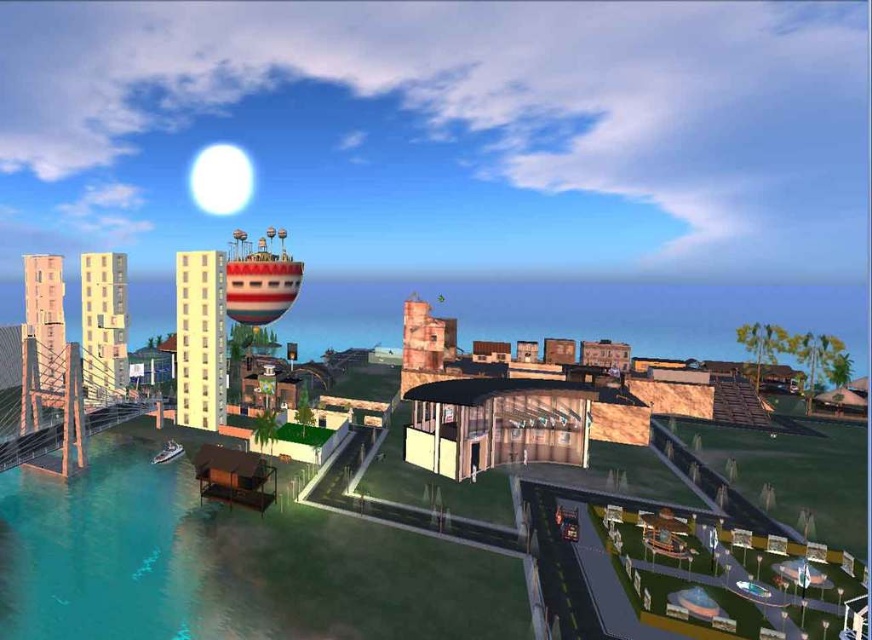
Between point (308, 538) and point (263, 250), which one is positioned in front?

Point (308, 538) is more forward.

How far apart are clear blue water at lower left and striped fabric water tower at upper center?

clear blue water at lower left is 169.44 feet away from striped fabric water tower at upper center.

Who is more distant from viewer, (44, 528) or (257, 269)?

Positioned behind is point (257, 269).

Locate an element on the screen. The height and width of the screenshot is (640, 872). clear blue water at lower left is located at coordinates (228, 563).

Is striped fabric water tower at upper center above metallic silver boat at lower left?

Yes, striped fabric water tower at upper center is above metallic silver boat at lower left.

Measure the distance between striped fabric water tower at upper center and metallic silver boat at lower left.

A distance of 55.90 meters exists between striped fabric water tower at upper center and metallic silver boat at lower left.

Between point (246, 280) and point (176, 445), which one is positioned behind?

Point (246, 280)

This screenshot has height=640, width=872. In order to click on striped fabric water tower at upper center in this screenshot , I will do `click(260, 278)`.

Is clear blue water at lower left positioned before metallic silver boat at lower left?

Yes, it is in front of metallic silver boat at lower left.

The height and width of the screenshot is (640, 872). What do you see at coordinates (228, 563) in the screenshot?
I see `clear blue water at lower left` at bounding box center [228, 563].

Identify the location of clear blue water at lower left. The width and height of the screenshot is (872, 640). (228, 563).